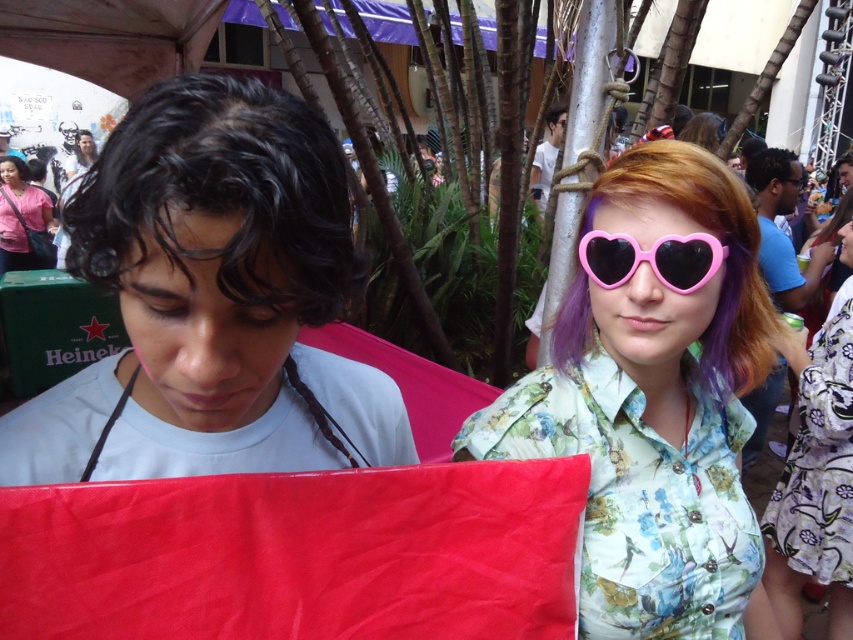
Question: Does pink heart-shaped sunglasses at upper right appear on the right side of smooth skin face at upper left?

Choices:
 (A) yes
 (B) no

Answer: (A)

Question: Considering the real-world distances, which object is closest to the pink matte sunglasses at upper left?

Choices:
 (A) pink heart-shaped sunglasses at upper right
 (B) purple dyed hair at upper right

Answer: (A)

Question: Which object appears closest to the camera in this image?

Choices:
 (A) pink plastic heart-shaped glasses at upper right
 (B) brown matte hair at upper left
 (C) floral fabric shirt at upper right
 (D) smooth skin face at upper left

Answer: (C)

Question: Is pink heart-shaped sunglasses at upper right above pink matte sunglasses at upper left?

Choices:
 (A) no
 (B) yes

Answer: (A)

Question: Observing the image, what is the correct spatial positioning of blue fabric at right in reference to brown matte hair at upper left?

Choices:
 (A) right
 (B) left

Answer: (A)

Question: Which of the following is the farthest from the observer?

Choices:
 (A) (540, 150)
 (B) (212, 132)
 (C) (787, 180)
 (D) (761, 240)

Answer: (A)